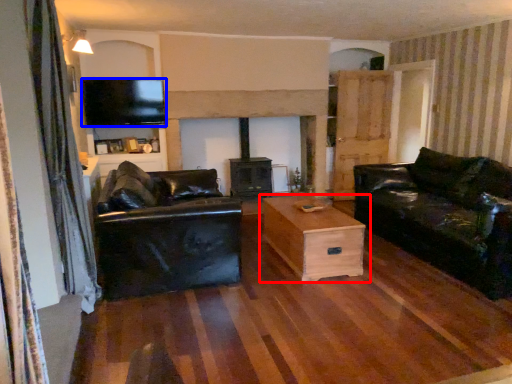
Question: Which object is further to the camera taking this photo, table (highlighted by a red box) or television (highlighted by a blue box)?

Choices:
 (A) table
 (B) television

Answer: (B)